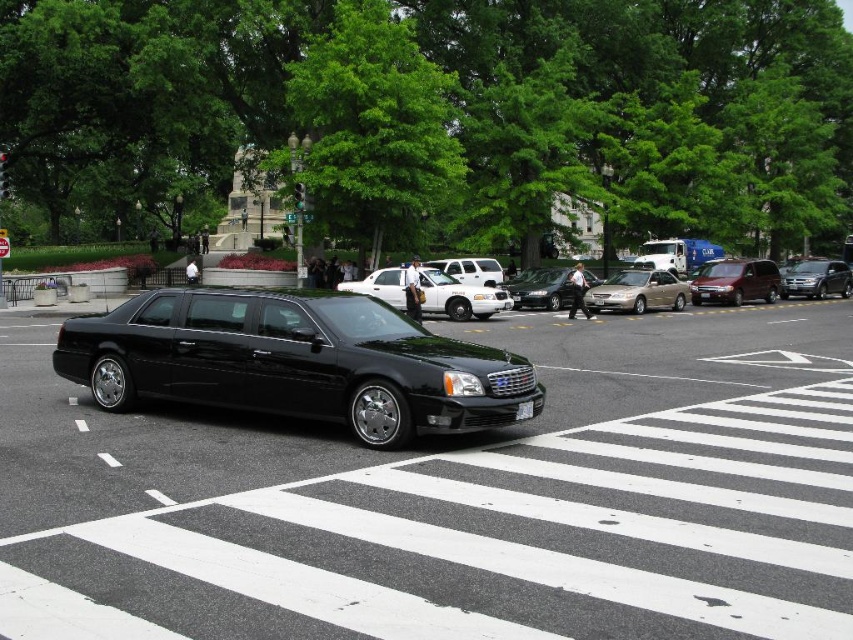
Is satin silver suv at right smaller than black plastic license plate at center?

No, satin silver suv at right is not smaller than black plastic license plate at center.

Describe the element at coordinates (816, 278) in the screenshot. I see `satin silver suv at right` at that location.

Does point (839, 266) come behind point (531, 416)?

Yes.

You are a GUI agent. You are given a task and a screenshot of the screen. Output one action in this format:
    pyautogui.click(x=<x>, y=<y>)
    Task: Click on the satin silver suv at right
    The height and width of the screenshot is (640, 853).
    Given the screenshot: What is the action you would take?
    pyautogui.click(x=816, y=278)

Which is above, metallic maroon minivan at right or satin silver suv at right?

satin silver suv at right

Which is below, metallic maroon minivan at right or satin silver suv at right?

Positioned lower is metallic maroon minivan at right.

Is point (763, 272) less distant than point (788, 288)?

Yes, it is.

The image size is (853, 640). Identify the location of metallic maroon minivan at right. (735, 282).

Does black glossy car at center have a greater width compared to shiny silver sedan at center?

Yes, black glossy car at center is wider than shiny silver sedan at center.

Which of these two, black glossy car at center or shiny silver sedan at center, stands taller?

With more height is shiny silver sedan at center.

Between point (206, 564) and point (535, 276), which one is positioned behind?

Positioned behind is point (535, 276).

This screenshot has height=640, width=853. In order to click on black glossy car at center in this screenshot , I will do `click(454, 499)`.